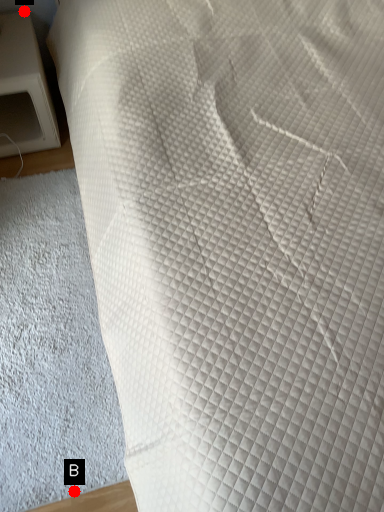
Question: Two points are circled on the image, labeled by A and B beside each circle. Which point appears closest to the camera in this image?

Choices:
 (A) A is closer
 (B) B is closer

Answer: (B)